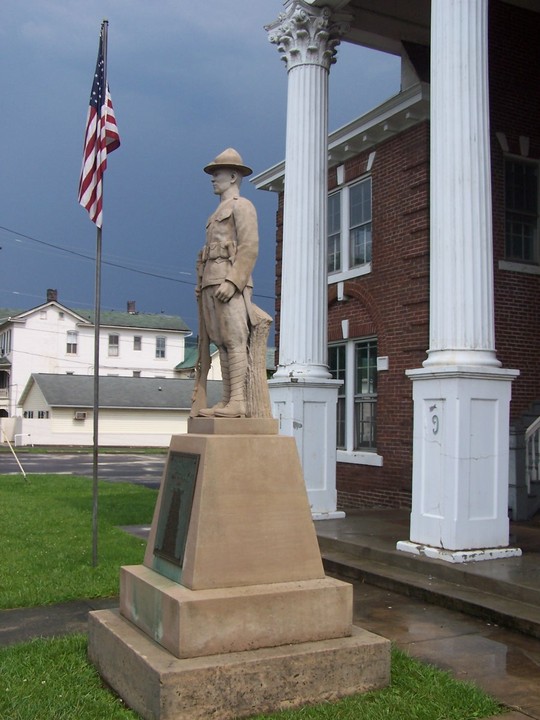
I want to click on air conditioner, so click(x=81, y=415).